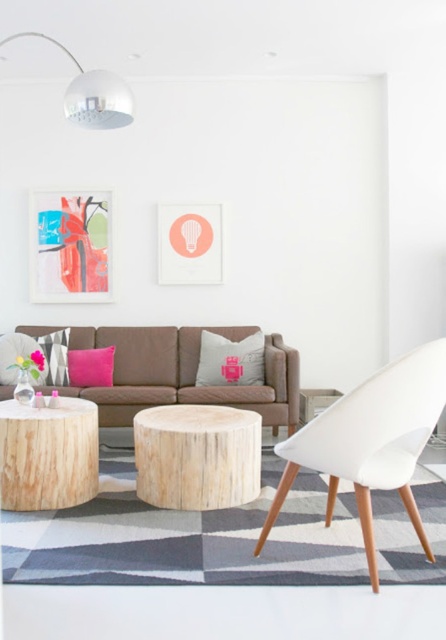
You are standing in the living room and want to reach a specific point marked at coordinates point (15, 410). Given that you are currently 12 feet away from that point, can you walk straight to it without any obstacles?

The distance of point (15, 410) from camera is 10.98 feet, so if you are currently 12 feet away, you are still 1.02 feet away from the point and can walk straight to it as there are no obstacles mentioned in the scene description.

Looking at this image, you are sitting on the brown sofa and want to reach the point at coordinates (x=230, y=360). Which object on the sofa are you trying to touch?

The point at coordinates (x=230, y=360) is located on the gray fabric pillow at center, so you are trying to touch the gray fabric pillow at center.